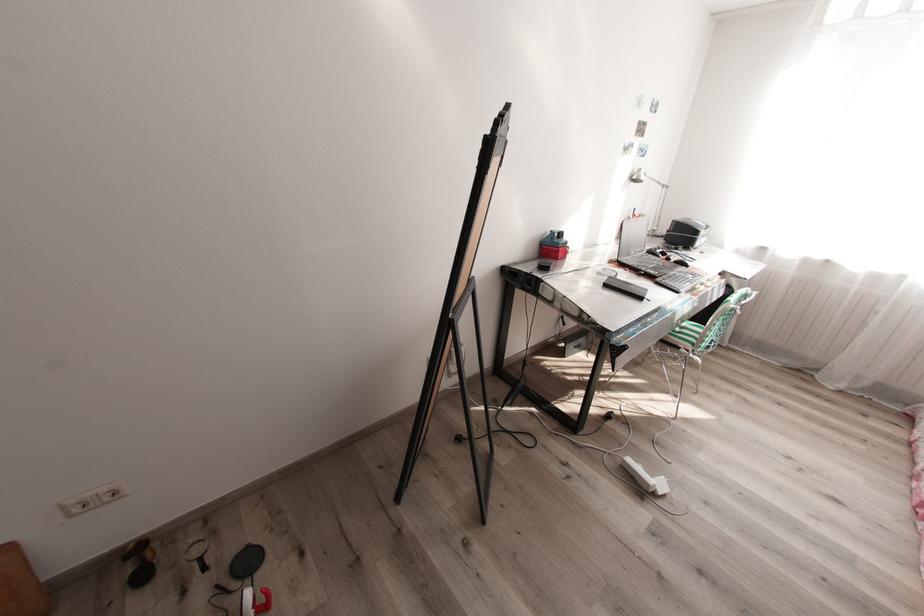
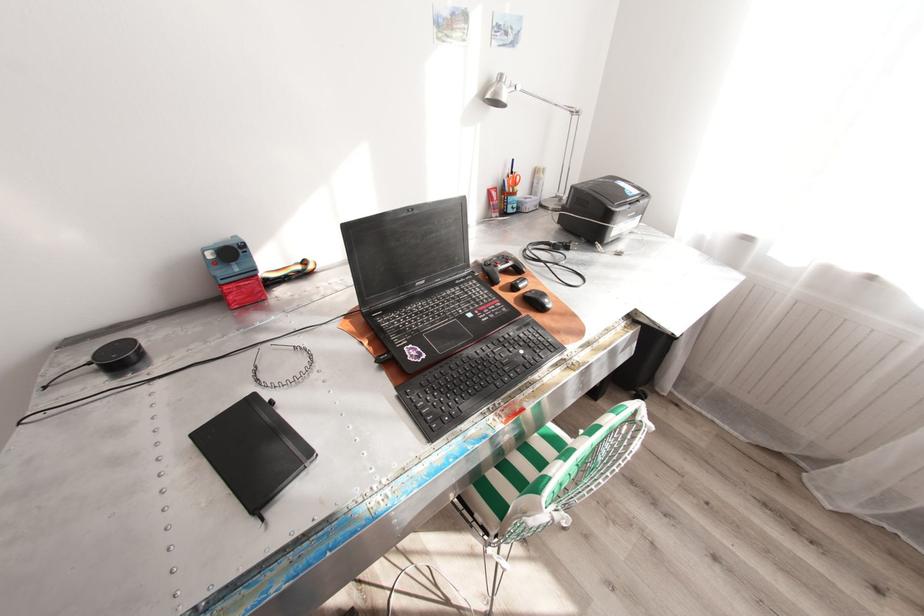
Find the pixel in the second image that matches pixel 561 235 in the first image.

(215, 254)